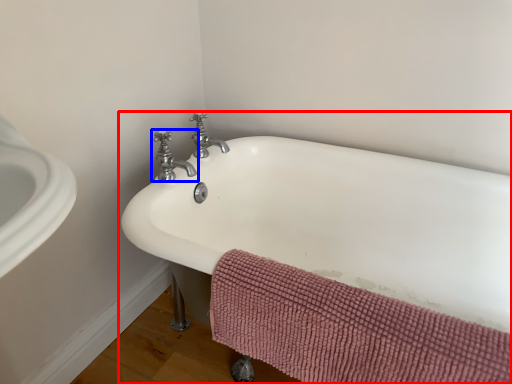
Question: Which of the following is the closest to the observer, bathtub (highlighted by a red box) or tap (highlighted by a blue box)?

Choices:
 (A) bathtub
 (B) tap

Answer: (A)